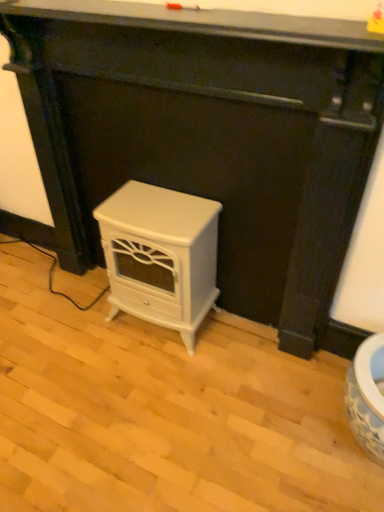
Question: Which direction should I rotate to look at white glossy stove at center, placed as the 2th furniture when sorted from left to right, — up or down?

Choices:
 (A) up
 (B) down

Answer: (A)

Question: Does white glossy stove at center, placed as the 2th furniture when sorted from left to right, appear on the left side of smooth black surface at upper center?

Choices:
 (A) no
 (B) yes

Answer: (A)

Question: Can you confirm if white glossy stove at center, which is the first furniture in right-to-left order, is smaller than smooth black surface at upper center?

Choices:
 (A) yes
 (B) no

Answer: (B)

Question: Does white glossy stove at center, placed as the 2th furniture when sorted from left to right, appear on the right side of smooth black surface at upper center?

Choices:
 (A) no
 (B) yes

Answer: (B)

Question: Considering the relative sizes of white glossy stove at center, which is the first furniture in right-to-left order, and smooth black surface at upper center in the image provided, is white glossy stove at center, which is the first furniture in right-to-left order, wider than smooth black surface at upper center?

Choices:
 (A) yes
 (B) no

Answer: (B)

Question: Considering the relative sizes of white glossy stove at center, placed as the 2th furniture when sorted from left to right, and smooth black surface at upper center in the image provided, is white glossy stove at center, placed as the 2th furniture when sorted from left to right, shorter than smooth black surface at upper center?

Choices:
 (A) no
 (B) yes

Answer: (A)

Question: From a real-world perspective, does white glossy stove at center, placed as the 2th furniture when sorted from left to right, sit lower than smooth black surface at upper center?

Choices:
 (A) no
 (B) yes

Answer: (B)

Question: Is white glossy stove at center, placed as the 2th furniture when sorted from left to right, aimed at white glossy electric stove at center, arranged as the second furniture when viewed from the right?

Choices:
 (A) yes
 (B) no

Answer: (A)

Question: From the image's perspective, is white glossy stove at center, which is the first furniture in right-to-left order, below white glossy electric stove at center, arranged as the second furniture when viewed from the right?

Choices:
 (A) yes
 (B) no

Answer: (B)

Question: Is white glossy stove at center, which is the first furniture in right-to-left order, wider than white glossy electric stove at center, the 1th furniture positioned from the left?

Choices:
 (A) yes
 (B) no

Answer: (B)

Question: From a real-world perspective, is white glossy stove at center, placed as the 2th furniture when sorted from left to right, located beneath white glossy electric stove at center, arranged as the second furniture when viewed from the right?

Choices:
 (A) yes
 (B) no

Answer: (B)

Question: Is white glossy stove at center, placed as the 2th furniture when sorted from left to right, positioned beyond the bounds of white glossy electric stove at center, arranged as the second furniture when viewed from the right?

Choices:
 (A) yes
 (B) no

Answer: (A)

Question: From the image's perspective, is white glossy stove at center, placed as the 2th furniture when sorted from left to right, on white glossy electric stove at center, arranged as the second furniture when viewed from the right?

Choices:
 (A) yes
 (B) no

Answer: (A)

Question: Does white glossy electric stove at center, arranged as the second furniture when viewed from the right, have a greater width compared to smooth black surface at upper center?

Choices:
 (A) no
 (B) yes

Answer: (B)